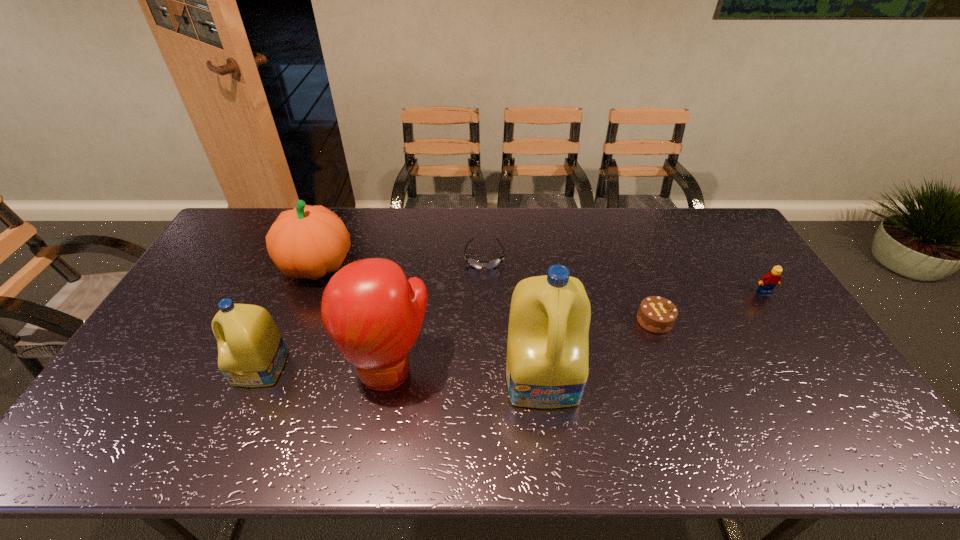
Find the location of a particular element. The height and width of the screenshot is (540, 960). object that is the fifth closest to the right detergent is located at coordinates (251, 352).

I want to click on object that is the second closest to the shortest object, so click(x=547, y=367).

I want to click on vacant space that satisfies the following two spatial constraints: 1. on the lenses of the sunglasses; 2. on the label of the left detergent, so click(486, 369).

The width and height of the screenshot is (960, 540). Identify the location of free space that satisfies the following two spatial constraints: 1. on the lenses of the sunglasses; 2. on the label of the left detergent. click(x=486, y=369).